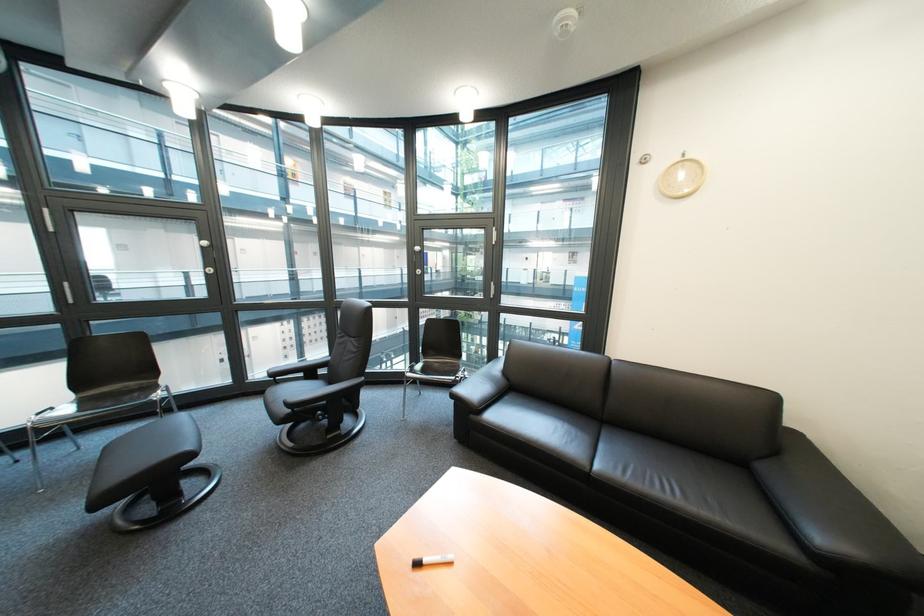
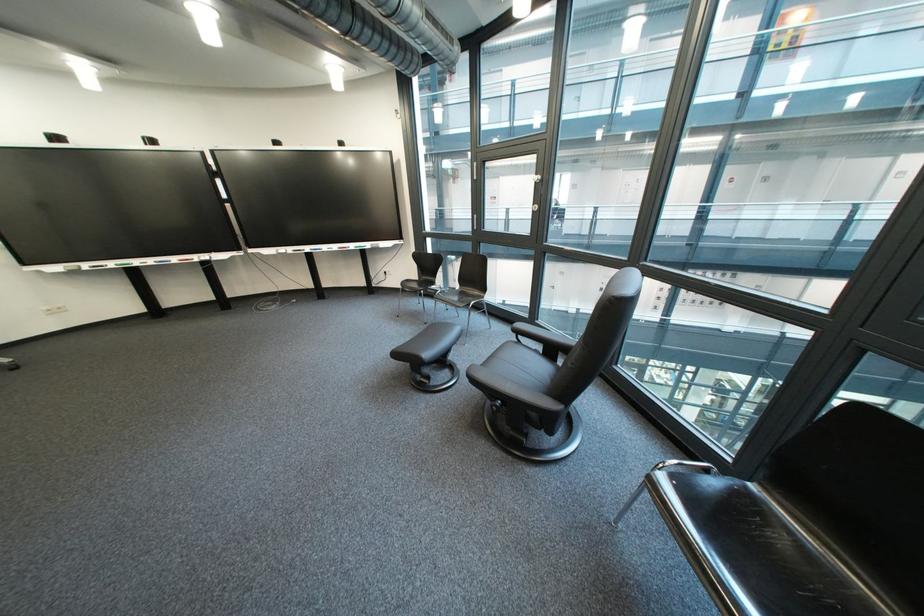
Locate, in the second image, the point that corresponds to point 219,430 in the first image.

(505, 344)